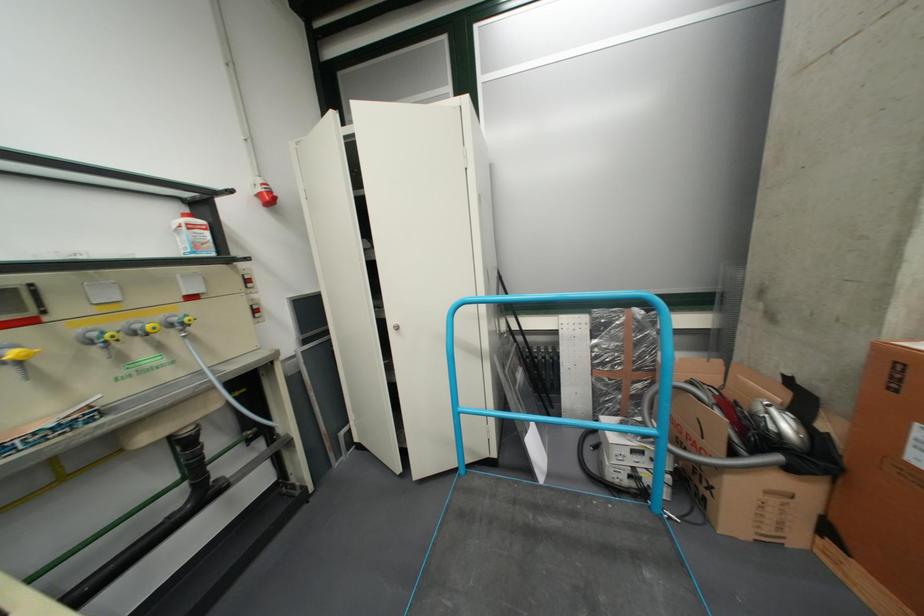
I want to click on open cardboard box, so click(747, 461).